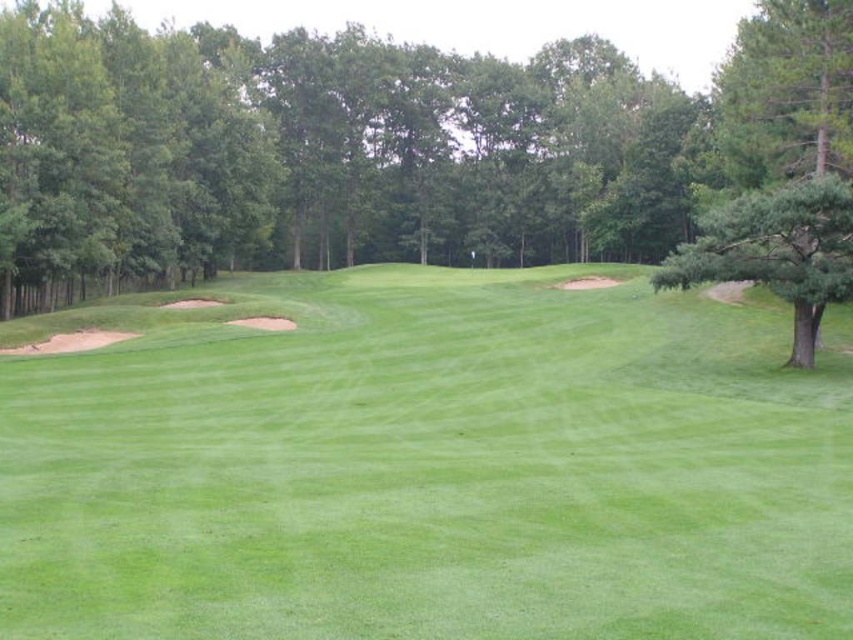
Question: Based on their relative distances, which object is nearer to the green grassy fairway at lower left?

Choices:
 (A) green textured tree at right
 (B) green leafy tree at center

Answer: (A)

Question: Which point is farther from the camera taking this photo?

Choices:
 (A) (566, 518)
 (B) (839, 221)
 (C) (219, 134)

Answer: (C)

Question: Does green grassy fairway at lower left have a smaller size compared to green textured tree at right?

Choices:
 (A) yes
 (B) no

Answer: (A)

Question: Can you confirm if green grassy fairway at lower left is thinner than green textured tree at right?

Choices:
 (A) yes
 (B) no

Answer: (B)

Question: Is green grassy fairway at lower left to the right of green textured tree at right from the viewer's perspective?

Choices:
 (A) no
 (B) yes

Answer: (A)

Question: Which object is the farthest from the green grassy fairway at lower left?

Choices:
 (A) green textured tree at right
 (B) green leafy tree at center

Answer: (B)